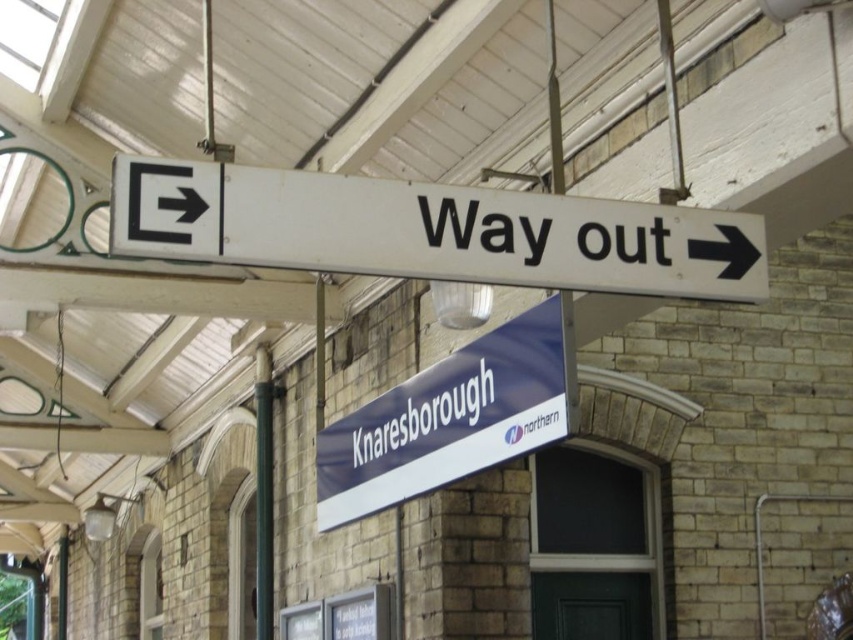
Question: Is white plastic sign at center in front of blue fabric sign at center?

Choices:
 (A) no
 (B) yes

Answer: (B)

Question: Which object appears closest to the camera in this image?

Choices:
 (A) blue fabric sign at center
 (B) white plastic sign at center

Answer: (B)

Question: Does white plastic sign at center have a lesser width compared to blue fabric sign at center?

Choices:
 (A) no
 (B) yes

Answer: (A)

Question: Is white plastic sign at center smaller than blue fabric sign at center?

Choices:
 (A) no
 (B) yes

Answer: (B)